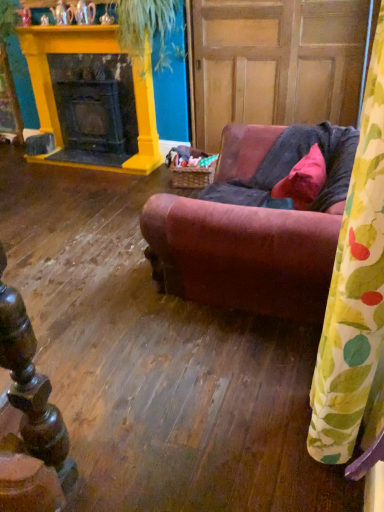
This screenshot has height=512, width=384. Identify the location of leather couch at center. (243, 255).

What is the approximate width of leather couch at center?

leather couch at center is 35.09 inches wide.

What do you see at coordinates (354, 289) in the screenshot? I see `yellow-green leaf-patterned curtain at right` at bounding box center [354, 289].

Describe the element at coordinates (148, 29) in the screenshot. This screenshot has width=384, height=512. I see `green leafy plant at upper center` at that location.

Image resolution: width=384 pixels, height=512 pixels. I want to click on yellow painted wood fireplace at upper left, so click(x=59, y=52).

This screenshot has height=512, width=384. Describe the element at coordinates (303, 180) in the screenshot. I see `matte pink fabric pillow at center` at that location.

Locate an element on the screen. The image size is (384, 512). leather couch at center is located at coordinates (243, 255).

Based on the photo, is matte pink fabric pillow at center next to green leafy plant at upper center?

There is a gap between matte pink fabric pillow at center and green leafy plant at upper center.

Does matte pink fabric pillow at center turn towards green leafy plant at upper center?

No, matte pink fabric pillow at center is not facing towards green leafy plant at upper center.

From the image's perspective, which one is positioned lower, matte pink fabric pillow at center or green leafy plant at upper center?

matte pink fabric pillow at center, from the image's perspective.

Considering the relative sizes of matte pink fabric pillow at center and green leafy plant at upper center in the image provided, is matte pink fabric pillow at center bigger than green leafy plant at upper center?

Actually, matte pink fabric pillow at center might be smaller than green leafy plant at upper center.

Considering the points (184, 274) and (273, 103), which point is in front, point (184, 274) or point (273, 103)?

Positioned in front is point (184, 274).

Locate an element on the screen. studio couch that appears on the left of wooden paneling at center is located at coordinates (243, 255).

Is leather couch at center facing towards wooden paneling at center?

No.

Considering the sizes of objects yellow painted wood fireplace at upper left and leather couch at center in the image provided, who is thinner, yellow painted wood fireplace at upper left or leather couch at center?

yellow painted wood fireplace at upper left is thinner.

Is yellow painted wood fireplace at upper left smaller than leather couch at center?

Indeed, yellow painted wood fireplace at upper left has a smaller size compared to leather couch at center.

Between yellow painted wood fireplace at upper left and leather couch at center, which one has less height?

leather couch at center.

Looking at this image, from a real-world perspective, is yellow painted wood fireplace at upper left on top of leather couch at center?

Indeed, from a real-world perspective, yellow painted wood fireplace at upper left stands above leather couch at center.

Can you tell me how much wooden paneling at center and green leafy plant at upper center differ in facing direction?

0.913 degrees separate the facing orientations of wooden paneling at center and green leafy plant at upper center.

Considering the sizes of wooden paneling at center and green leafy plant at upper center in the image, is wooden paneling at center wider or thinner than green leafy plant at upper center?

Clearly, wooden paneling at center has more width compared to green leafy plant at upper center.

In the scene shown: Does wooden paneling at center lie behind green leafy plant at upper center?

That is False.

The image size is (384, 512). I want to click on plant behind the wooden paneling at center, so (x=148, y=29).

Considering the positions of objects yellow painted wood fireplace at upper left and matte pink fabric pillow at center in the image provided, who is more to the left, yellow painted wood fireplace at upper left or matte pink fabric pillow at center?

From the viewer's perspective, yellow painted wood fireplace at upper left appears more on the left side.

Is yellow painted wood fireplace at upper left touching matte pink fabric pillow at center?

No, yellow painted wood fireplace at upper left is not beside matte pink fabric pillow at center.

Is yellow painted wood fireplace at upper left looking in the opposite direction of matte pink fabric pillow at center?

yellow painted wood fireplace at upper left is not turned away from matte pink fabric pillow at center.

From a real-world perspective, is yellow painted wood fireplace at upper left below matte pink fabric pillow at center?

Incorrect, from a real-world perspective, yellow painted wood fireplace at upper left is higher than matte pink fabric pillow at center.

From a real-world perspective, is matte pink fabric pillow at center located beneath yellow painted wood fireplace at upper left?

Correct, in the physical world, matte pink fabric pillow at center is lower than yellow painted wood fireplace at upper left.

Would you consider matte pink fabric pillow at center to be distant from yellow painted wood fireplace at upper left?

matte pink fabric pillow at center is positioned a significant distance from yellow painted wood fireplace at upper left.

Is matte pink fabric pillow at center oriented away from yellow painted wood fireplace at upper left?

No, yellow painted wood fireplace at upper left is not at the back of matte pink fabric pillow at center.

Does point (247, 12) lie behind point (149, 137)?

No, (247, 12) is in front of (149, 137).

Considering the sizes of wooden paneling at center and yellow painted wood fireplace at upper left in the image, is wooden paneling at center wider or thinner than yellow painted wood fireplace at upper left?

In the image, wooden paneling at center appears to be wider than yellow painted wood fireplace at upper left.

From a real-world perspective, which is physically above, wooden paneling at center or yellow painted wood fireplace at upper left?

wooden paneling at center.

Locate an element on the screen. pillow below the green leafy plant at upper center (from the image's perspective) is located at coordinates (303, 180).

You are a GUI agent. You are given a task and a screenshot of the screen. Output one action in this format:
    pyautogui.click(x=<x>, y=<y>)
    Task: Click on the studio couch on the left of the wooden paneling at center
    The height and width of the screenshot is (512, 384).
    Given the screenshot: What is the action you would take?
    pyautogui.click(x=243, y=255)

When comparing their distances from leather couch at center, does wooden paneling at center or matte pink fabric pillow at center seem closer?

The object closer to leather couch at center is matte pink fabric pillow at center.

Estimate the real-world distances between objects in this image. Which object is closer to green leafy plant at upper center, wooden paneling at center or yellow painted wood fireplace at upper left?

The object closer to green leafy plant at upper center is yellow painted wood fireplace at upper left.

Which object lies further to the anchor point matte pink fabric pillow at center, wooden paneling at center or green leafy plant at upper center?

green leafy plant at upper center is further to matte pink fabric pillow at center.

Which object lies further to the anchor point yellow painted wood fireplace at upper left, green leafy plant at upper center or matte pink fabric pillow at center?

matte pink fabric pillow at center lies further to yellow painted wood fireplace at upper left than the other object.

Looking at the image, which one is located closer to yellow-green leaf-patterned curtain at right, wooden paneling at center or leather couch at center?

Among the two, leather couch at center is located nearer to yellow-green leaf-patterned curtain at right.

When comparing their distances from leather couch at center, does yellow-green leaf-patterned curtain at right or matte pink fabric pillow at center seem further?

Result: The object further to leather couch at center is yellow-green leaf-patterned curtain at right.

From the image, which object appears to be nearer to matte pink fabric pillow at center, yellow-green leaf-patterned curtain at right or yellow painted wood fireplace at upper left?

yellow-green leaf-patterned curtain at right lies closer to matte pink fabric pillow at center than the other object.

Which object lies further to the anchor point wooden paneling at center, green leafy plant at upper center or leather couch at center?

leather couch at center.

I want to click on plant between leather couch at center and yellow painted wood fireplace at upper left from front to back, so click(148, 29).

Find the location of a particular element. door between leather couch at center and yellow painted wood fireplace at upper left along the z-axis is located at coordinates click(x=276, y=63).

Identify the location of studio couch between yellow-green leaf-patterned curtain at right and green leafy plant at upper center along the z-axis. pos(243,255).

Identify the location of pillow between yellow painted wood fireplace at upper left and wooden paneling at center. (303, 180).